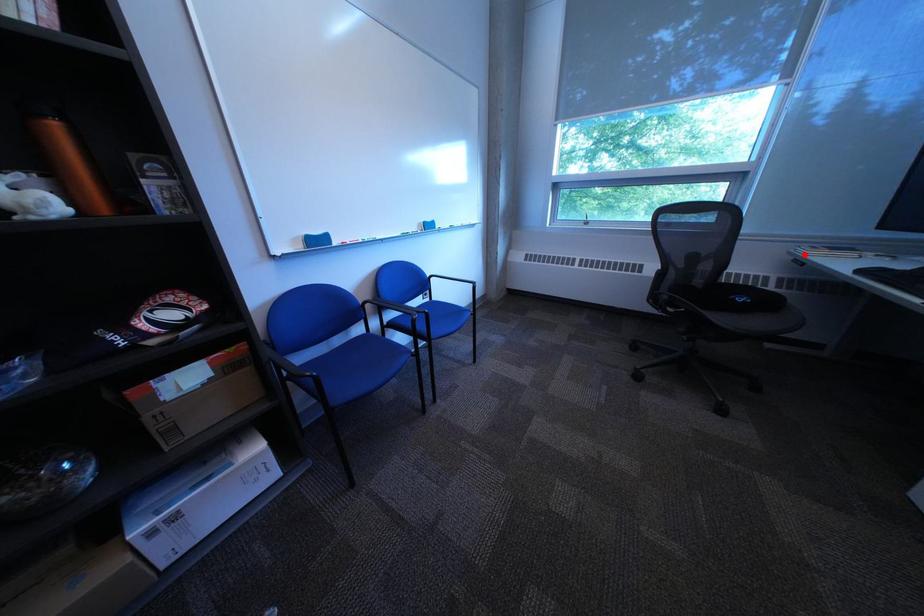
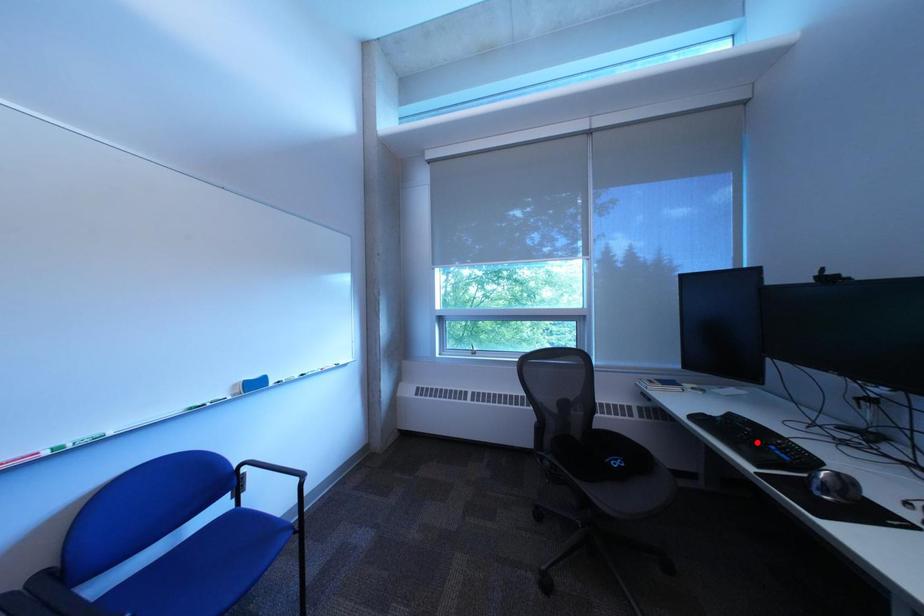
I am providing you with two images of the same scene from different viewpoints. A red point is marked on the first image and another point is marked on the second image. Are the points marked in image1 and image2 representing the same 3D position?

No